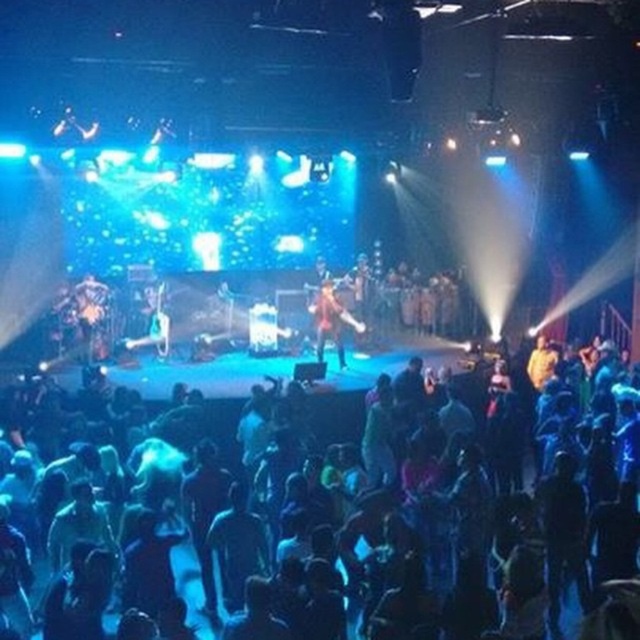
Does black matte crowd at lower left have a greater width compared to shiny red jacket at center?

In fact, black matte crowd at lower left might be narrower than shiny red jacket at center.

Does point (417, 490) lie behind point (330, 336)?

No, (417, 490) is closer to viewer.

At what (x,y) coordinates should I click in order to perform the action: click on black matte crowd at lower left. Please return your answer as a coordinate pair (x, y). This screenshot has height=640, width=640. Looking at the image, I should click on (429, 531).